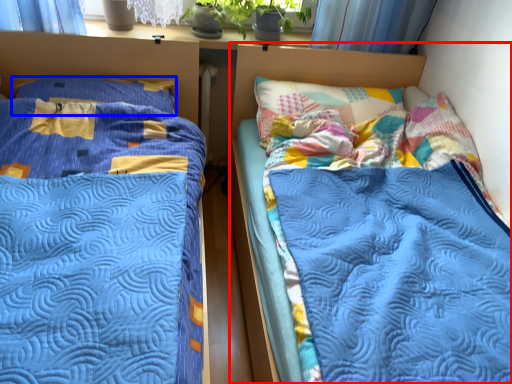
Question: Which point is further to the camera, bed (highlighted by a red box) or pillow (highlighted by a blue box)?

Choices:
 (A) bed
 (B) pillow

Answer: (B)